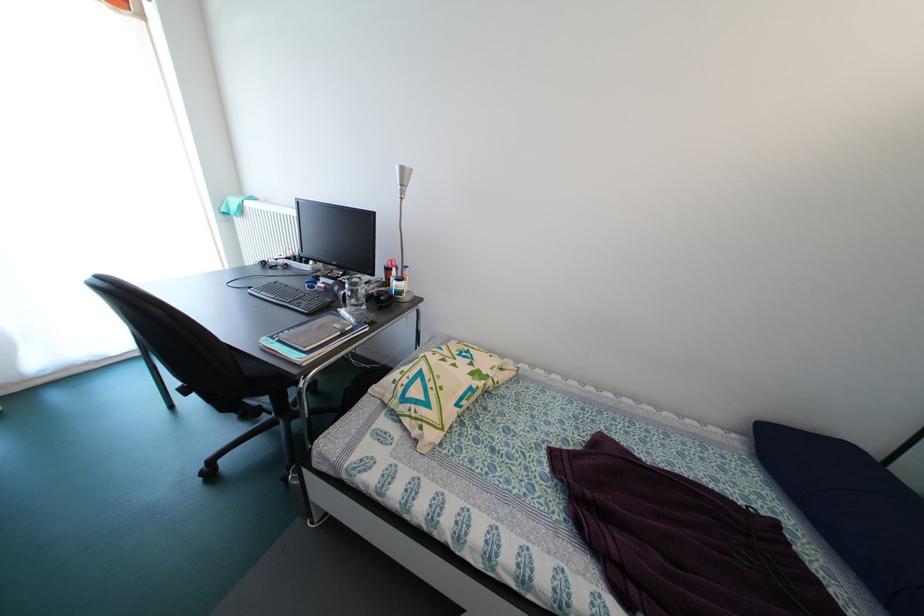
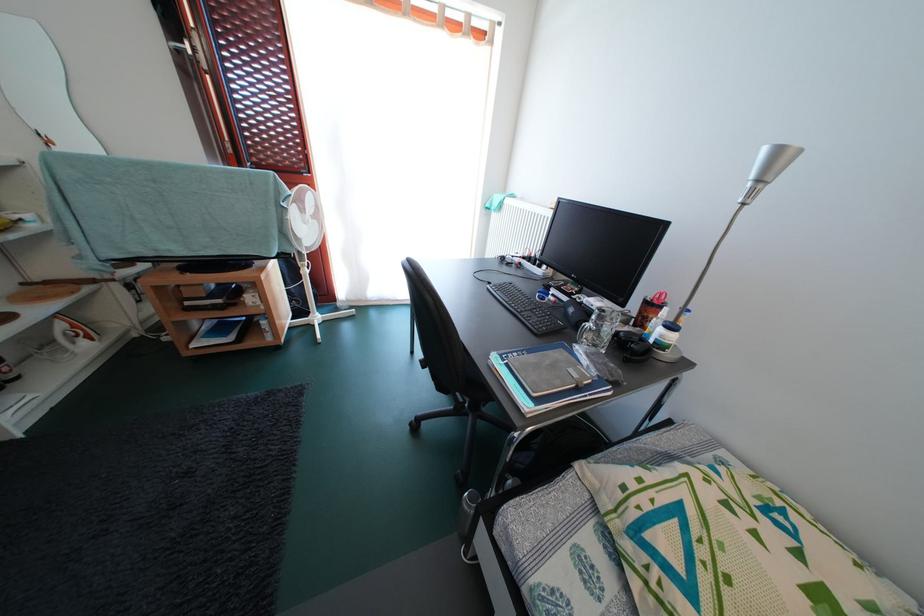
Where in the second image is the point corresponding to (x=258, y=299) from the first image?

(495, 294)